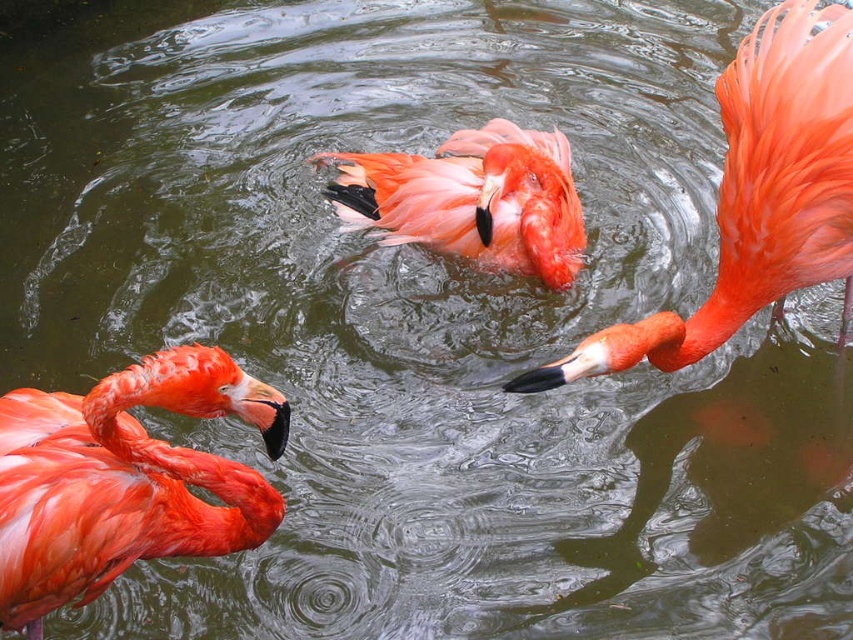
You are standing on the shore of the pond and want to observe both the matte orange flamingo at right and the matte pink flamingo at center. Which flamingo appears larger to you?

The matte orange flamingo at right appears larger because it is closer to you than the matte pink flamingo at center.

You are a birdwatcher observing the three flamingos in the pond. You notice the matte orange flamingo at right and the matte pink flamingo at center. Which one has a larger size?

The matte orange flamingo at right is bigger than the matte pink flamingo at center.

You are a wildlife photographer observing the scene. You notice two flamingos, the matte pink flamingo at left and the matte pink flamingo at center. Which one do you think is closer to the water surface?

The matte pink flamingo at left is smaller in size compared to the matte pink flamingo at center. Since smaller objects can appear closer when they are actually farther away due to perspective, but in this case, the description states the matte pink flamingo at left has a smaller size, which might indicate it is farther from the viewer. However, the question asks about proximity to the water surface, not the viewer. The size difference could be due to actual size or distance. Without depth cues, we cannot 1